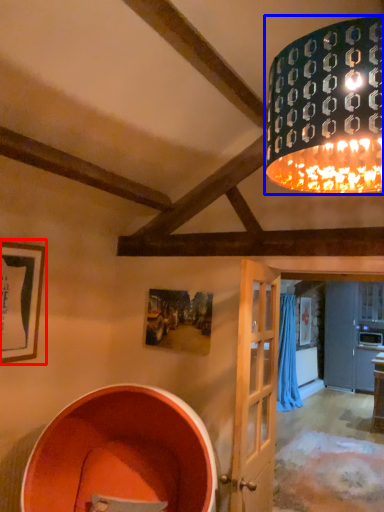
Question: Which object appears farthest to the camera in this image, picture frame (highlighted by a red box) or lamp (highlighted by a blue box)?

Choices:
 (A) picture frame
 (B) lamp

Answer: (A)